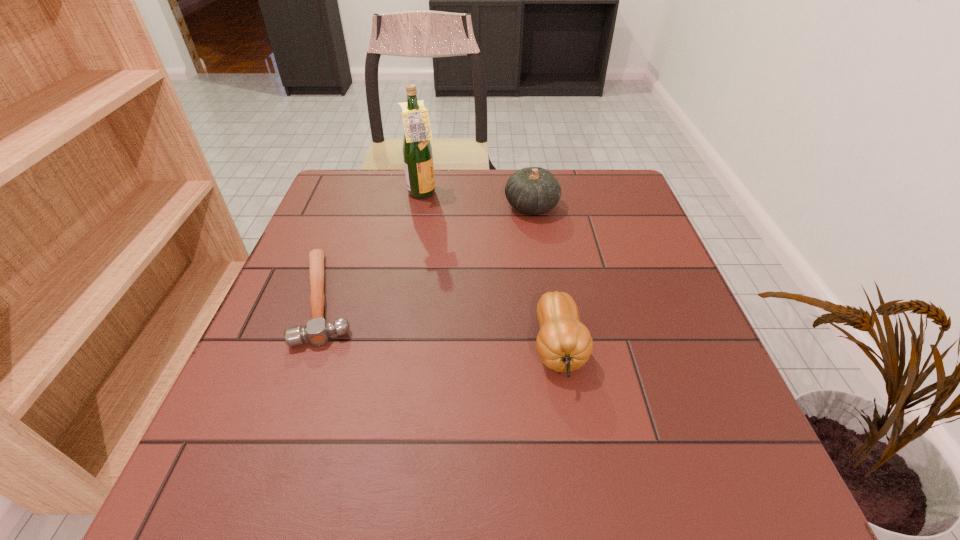
At what (x,y) coordinates should I click in order to perform the action: click on unoccupied position between the nearer gourd and the farther gourd. Please return your answer as a coordinate pair (x, y). This screenshot has width=960, height=540. Looking at the image, I should click on (545, 277).

Locate an element on the screen. The height and width of the screenshot is (540, 960). free space between the hammer and the farther gourd is located at coordinates tap(429, 252).

Image resolution: width=960 pixels, height=540 pixels. I want to click on blank region between the hammer and the farther gourd, so click(429, 252).

The width and height of the screenshot is (960, 540). I want to click on free space between the farther gourd and the shorter gourd, so click(545, 277).

Where is `free space between the liquor and the farther gourd`? free space between the liquor and the farther gourd is located at coordinates (477, 200).

The image size is (960, 540). I want to click on vacant area between the third tallest object and the hammer, so click(443, 323).

Identify the location of free space between the shorter gourd and the farther gourd. (545, 277).

This screenshot has height=540, width=960. Find the location of `blank region between the farther gourd and the leftmost object`. blank region between the farther gourd and the leftmost object is located at coordinates (429, 252).

You are a GUI agent. You are given a task and a screenshot of the screen. Output one action in this format:
    pyautogui.click(x=<x>, y=<y>)
    Task: Click on the vacant space in between the second object from left to right and the leftmost object
    The height and width of the screenshot is (540, 960).
    Given the screenshot: What is the action you would take?
    pyautogui.click(x=374, y=246)

The height and width of the screenshot is (540, 960). I want to click on object that is the closest to the shorter gourd, so click(x=532, y=190).